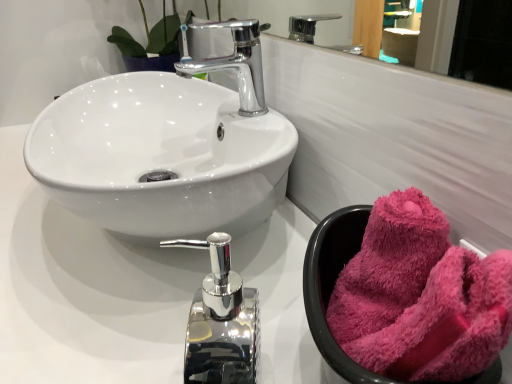
Question: From a real-world perspective, relative to fuzzy pink towel at right, is polished chrome tap at center, which ranks as the 2th tap in back-to-front order, vertically above or below?

Choices:
 (A) above
 (B) below

Answer: (B)

Question: Which is correct: polished chrome tap at center, which ranks as the 2th tap in top-to-bottom order, is inside fuzzy pink towel at right, or outside of it?

Choices:
 (A) outside
 (B) inside

Answer: (A)

Question: Which is nearer to the polished chrome tap at center, which ranks as the 1th tap in front-to-back order?

Choices:
 (A) fuzzy pink towel at right
 (B) chrome/metallic faucet at upper center, marked as the 2th tap in a front-to-back arrangement
 (C) glossy chrome mirror at upper center

Answer: (A)

Question: Which of these objects is positioned farthest from the glossy chrome mirror at upper center?

Choices:
 (A) fuzzy pink towel at right
 (B) chrome/metallic faucet at upper center, marked as the 2th tap in a front-to-back arrangement
 (C) polished chrome tap at center, which ranks as the 2th tap in back-to-front order

Answer: (A)